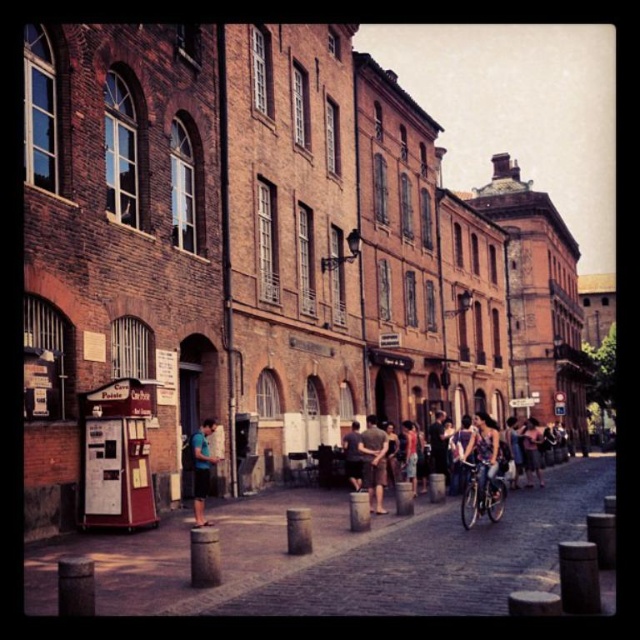
Does matte purple bicycle at center appear over shiny silver bicycle at center-right?

No, matte purple bicycle at center is not above shiny silver bicycle at center-right.

Measure the distance between point (484, 484) and camera.

142.25 feet

Locate an element on the screen. The image size is (640, 640). matte purple bicycle at center is located at coordinates (484, 458).

Can you confirm if matte purple bicycle at center is thinner than blue fabric shirt at center?

No.

Can you confirm if matte purple bicycle at center is wider than blue fabric shirt at center?

Indeed, matte purple bicycle at center has a greater width compared to blue fabric shirt at center.

Is point (499, 445) farther from viewer compared to point (204, 456)?

Yes.

Where is `matte purple bicycle at center`? matte purple bicycle at center is located at coordinates (484, 458).

Looking at this image, which is above, matte gray shirt at center or dark gray fabric pants at center?

matte gray shirt at center is higher up.

What do you see at coordinates (372, 461) in the screenshot? The image size is (640, 640). I see `matte gray shirt at center` at bounding box center [372, 461].

Who is more distant from viewer, (378, 484) or (349, 433)?

The point (349, 433) is behind.

Identify the location of matte gray shirt at center. This screenshot has height=640, width=640. (372, 461).